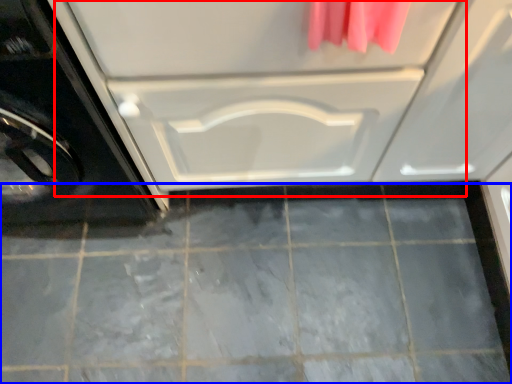
Question: Which object appears closest to the camera in this image, drawer (highlighted by a red box) or ceramic tile (highlighted by a blue box)?

Choices:
 (A) drawer
 (B) ceramic tile

Answer: (A)